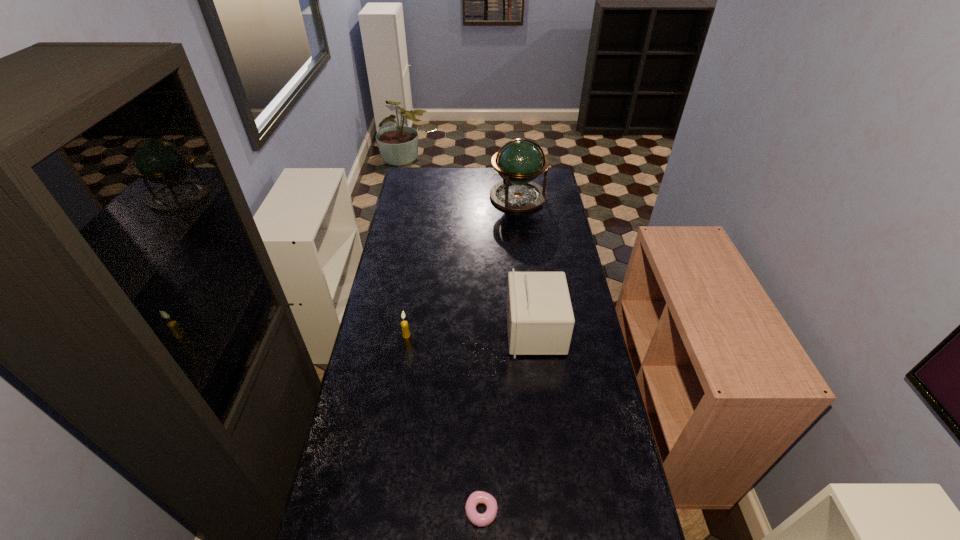
The image size is (960, 540). Find the location of `free space located 0.280m on the front-facing side of the first-aid kit`. free space located 0.280m on the front-facing side of the first-aid kit is located at coordinates (433, 330).

You are a GUI agent. You are given a task and a screenshot of the screen. Output one action in this format:
    pyautogui.click(x=<x>, y=<y>)
    Task: Click on the vacant space situated on the back of the candle
    
    Given the screenshot: What is the action you would take?
    pyautogui.click(x=418, y=265)

The image size is (960, 540). I want to click on vacant space located on the back of the doughnut, so click(481, 463).

In order to click on object that is at the far edge in this screenshot , I will do (520, 161).

This screenshot has width=960, height=540. I want to click on object situated at the left edge, so click(x=404, y=324).

Identify the location of globe that is at the right edge. (520, 161).

Locate an element on the screen. the first-aid kit positioned at the right edge is located at coordinates (540, 320).

Image resolution: width=960 pixels, height=540 pixels. Identify the location of object that is at the far right corner. pyautogui.click(x=520, y=161).

Locate an element on the screen. This screenshot has width=960, height=540. free point at the far edge is located at coordinates (493, 182).

The height and width of the screenshot is (540, 960). Identify the location of free location at the left edge of the desktop. (425, 223).